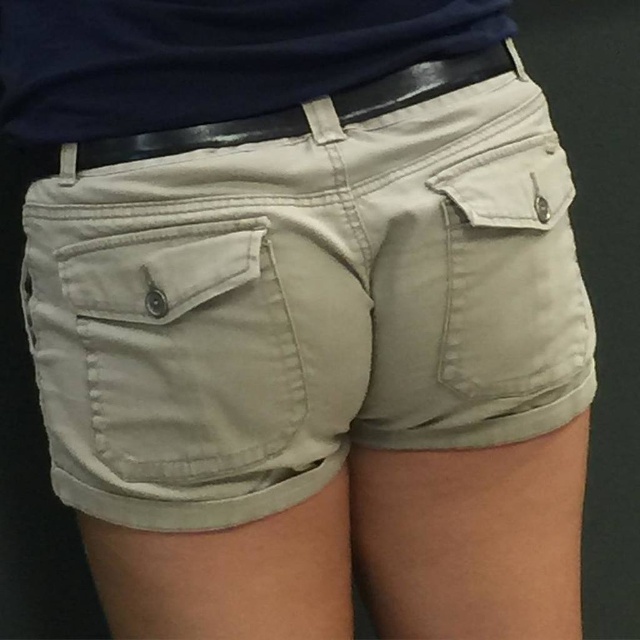
Question: Considering the relative positions of light beige cotton pocket at lower center and matte beige pocket at right in the image provided, where is light beige cotton pocket at lower center located with respect to matte beige pocket at right?

Choices:
 (A) below
 (B) above

Answer: (A)

Question: Which object is the closest to the matte beige pocket at right?

Choices:
 (A) black leather belt at upper center
 (B) light beige cotton pocket at lower center

Answer: (A)

Question: Estimate the real-world distances between objects in this image. Which object is farther from the matte beige pocket at right?

Choices:
 (A) light beige cotton pocket at lower center
 (B) black leather belt at upper center

Answer: (A)

Question: Is black leather belt at upper center further to camera compared to matte beige pocket at right?

Choices:
 (A) no
 (B) yes

Answer: (A)

Question: Which of the following is the closest to the observer?

Choices:
 (A) light beige cotton pocket at lower center
 (B) matte beige pocket at right
 (C) black leather belt at upper center

Answer: (A)

Question: Does light beige cotton pocket at lower center have a greater width compared to matte beige pocket at right?

Choices:
 (A) yes
 (B) no

Answer: (A)